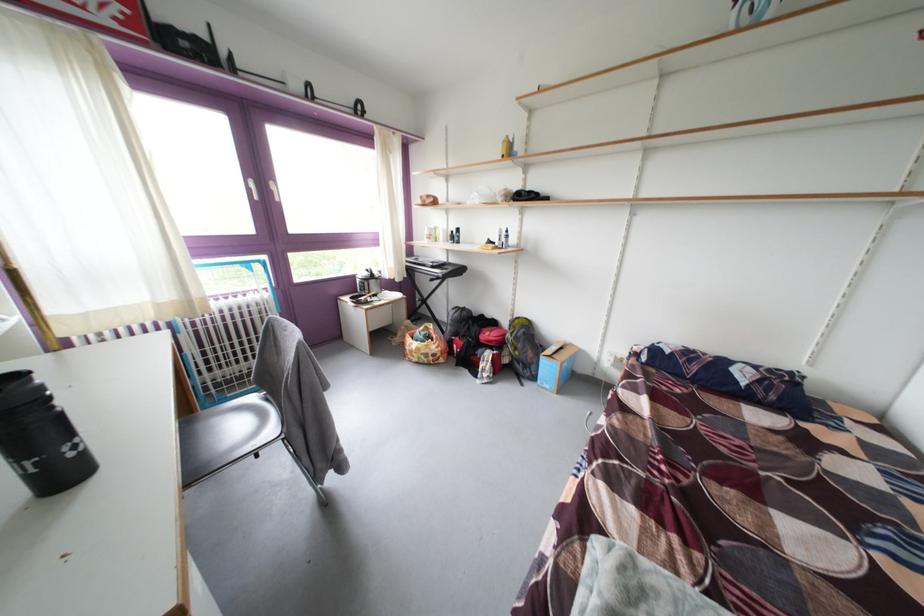
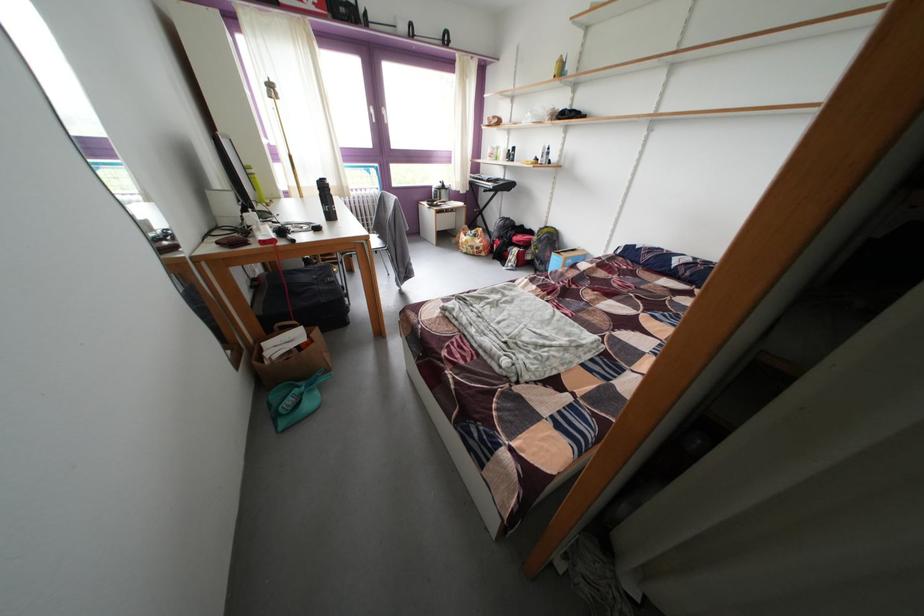
Which direction would the cameraman need to move to produce the second image?

The movement direction of the cameraman is right, backward.